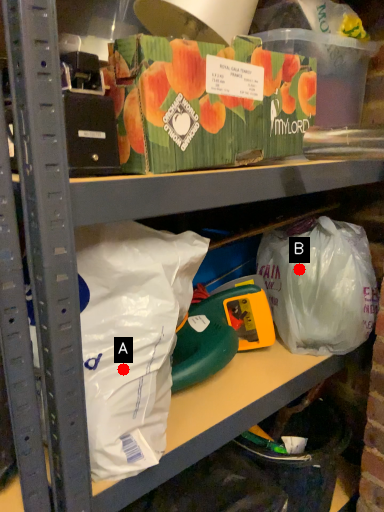
Question: Two points are circled on the image, labeled by A and B beside each circle. Which point is farther to the camera?

Choices:
 (A) A is further
 (B) B is further

Answer: (B)